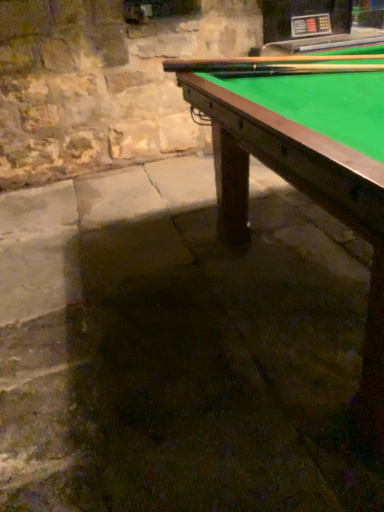
Image resolution: width=384 pixels, height=512 pixels. Find the location of `free location above smooth wood cue at upper right, the 2th cue in the top-to-bottom sequence (from a real-world perspective)`. free location above smooth wood cue at upper right, the 2th cue in the top-to-bottom sequence (from a real-world perspective) is located at coordinates (292, 63).